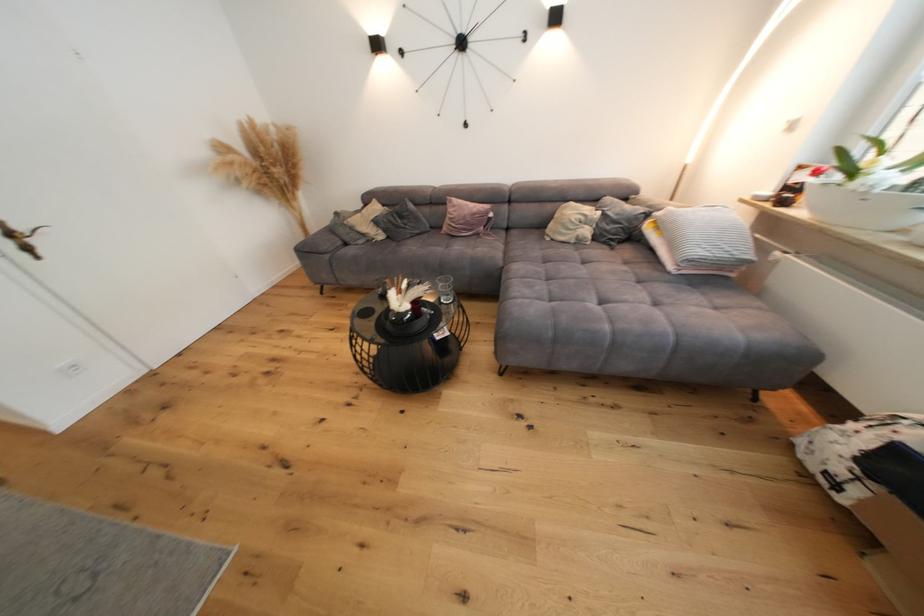
Where would you lean the sofa armrest? Please return your answer as a coordinate pair (x, y).

(331, 236)